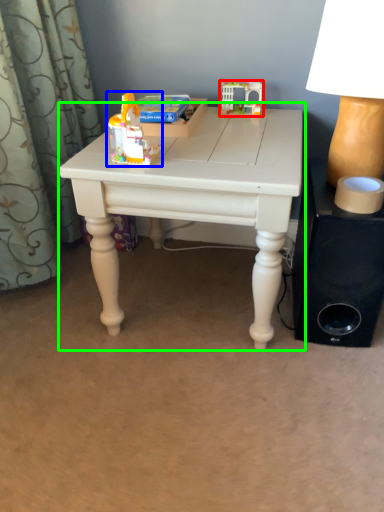
Question: Considering the real-world distances, which object is farthest from toy (highlighted by a red box)? toy (highlighted by a blue box) or table (highlighted by a green box)?

Choices:
 (A) toy
 (B) table

Answer: (A)